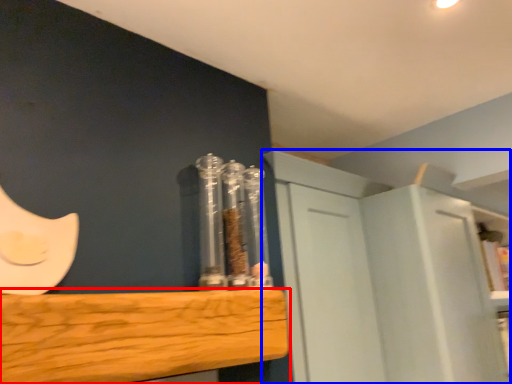
Question: Which object is closer to the camera taking this photo, furniture (highlighted by a red box) or cabinetry (highlighted by a blue box)?

Choices:
 (A) furniture
 (B) cabinetry

Answer: (A)